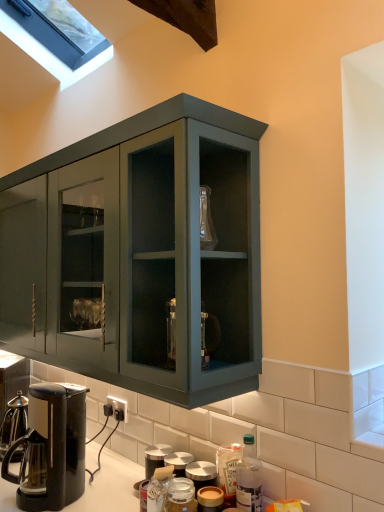
Question: Based on their positions, is translucent plastic bottle at lower center, which is the second bottle in right-to-left order, located to the left or right of translucent glass jar at lower center, which ranks as the third bottle in right-to-left order?

Choices:
 (A) left
 (B) right

Answer: (B)

Question: Relative to translucent glass jar at lower center, which ranks as the third bottle in right-to-left order, is translucent plastic bottle at lower center, which is the second bottle in right-to-left order, in front or behind?

Choices:
 (A) behind
 (B) front

Answer: (A)

Question: Which object is positioned closest to the translucent glass jar at lower center, which ranks as the 1th bottle in left-to-right order?

Choices:
 (A) translucent plastic bottle at lower center, which is the third bottle in left-to-right order
 (B) translucent plastic bottle at lower center, which is the second bottle in right-to-left order
 (C) black glossy coffee maker at lower left
 (D) clear glass window at upper left

Answer: (B)

Question: Considering the real-world distances, which object is farthest from the clear glass window at upper left?

Choices:
 (A) translucent glass jar at lower center, which ranks as the 1th bottle in left-to-right order
 (B) black glossy coffee maker at lower left
 (C) translucent plastic bottle at lower center, which is the second bottle in right-to-left order
 (D) translucent plastic bottle at lower center, which is the third bottle in left-to-right order

Answer: (A)